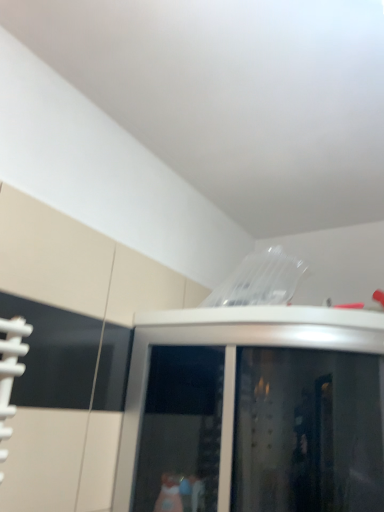
Consider the image. What is the approximate height of transparent plastic screen door at center?

The height of transparent plastic screen door at center is 28.59 inches.

What do you see at coordinates (254, 411) in the screenshot?
I see `transparent plastic screen door at center` at bounding box center [254, 411].

Locate an element on the screen. Image resolution: width=384 pixels, height=512 pixels. transparent plastic screen door at center is located at coordinates (254, 411).

In order to face transparent plastic screen door at center, should I rotate leftwards or rightwards?

You should rotate right by 13.739 degrees.

Identify the location of transparent plastic screen door at center. This screenshot has width=384, height=512. (254, 411).